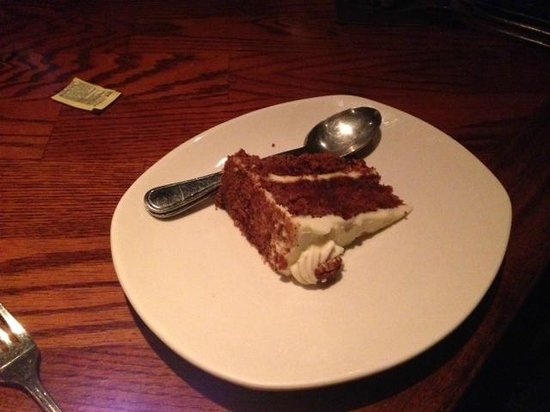
Locate an element on the screen. table is located at coordinates (68, 242).